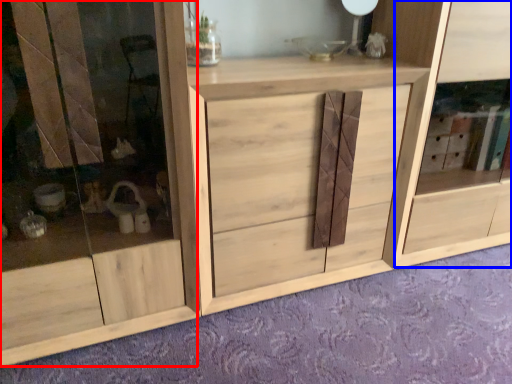
Question: Among these objects, which one is farthest to the camera, screen door (highlighted by a red box) or cabinet (highlighted by a blue box)?

Choices:
 (A) screen door
 (B) cabinet

Answer: (B)